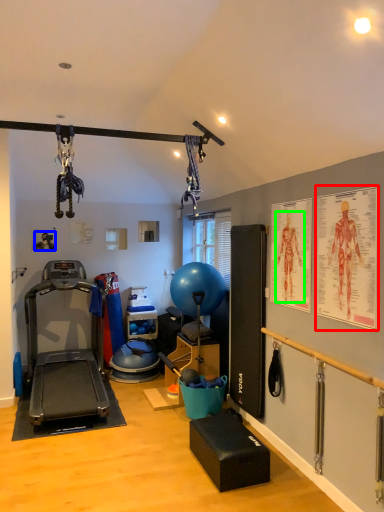
Question: Considering the real-world distances, which object is farthest from poster page (highlighted by a red box)? person (highlighted by a blue box) or person (highlighted by a green box)?

Choices:
 (A) person
 (B) person

Answer: (A)